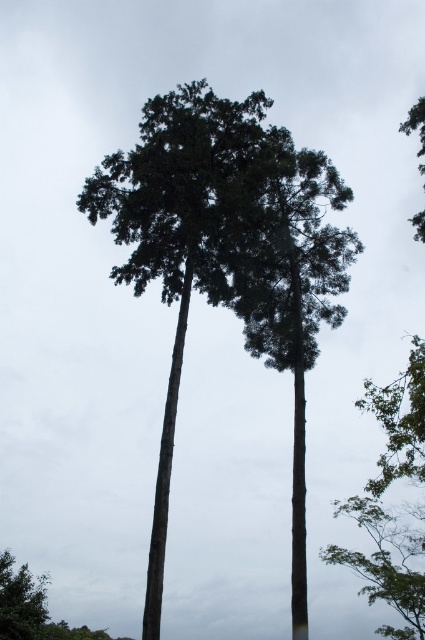
Can you confirm if green leafy palm tree at center is shorter than green textured palm tree at center?

Incorrect, green leafy palm tree at center's height does not fall short of green textured palm tree at center's.

Is point (201, 88) farther from camera compared to point (291, 573)?

Yes, it is behind point (291, 573).

Where is `green leafy palm tree at center`? The height and width of the screenshot is (640, 425). green leafy palm tree at center is located at coordinates (181, 234).